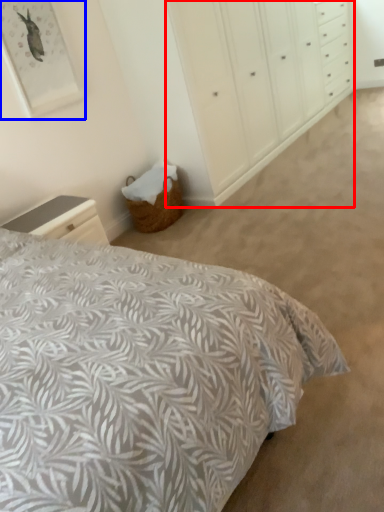
Question: Which object is closer to the camera taking this photo, dresser (highlighted by a red box) or picture frame (highlighted by a blue box)?

Choices:
 (A) dresser
 (B) picture frame

Answer: (B)